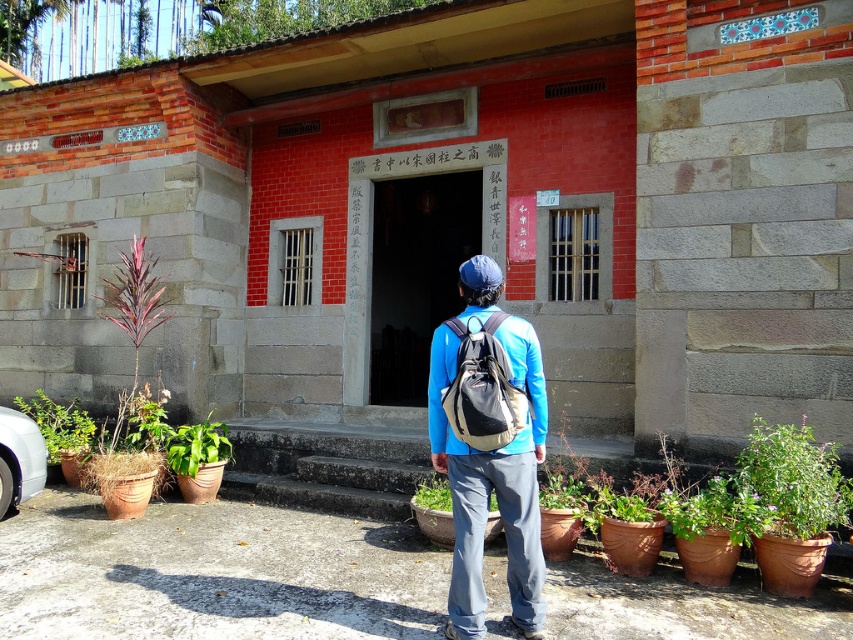
You are a delivery person who needs to place a package on the ground next to the silver metallic car at lower left. However, there is a blue fabric backpack at center in the way. Can you move the package around the backpack to reach the car without lifting the backpack?

The blue fabric backpack at center is taller than the silver metallic car at lower left, so you can move the package around the backpack since the car is lower and the backpack might block direct access but allows going around due to height difference.